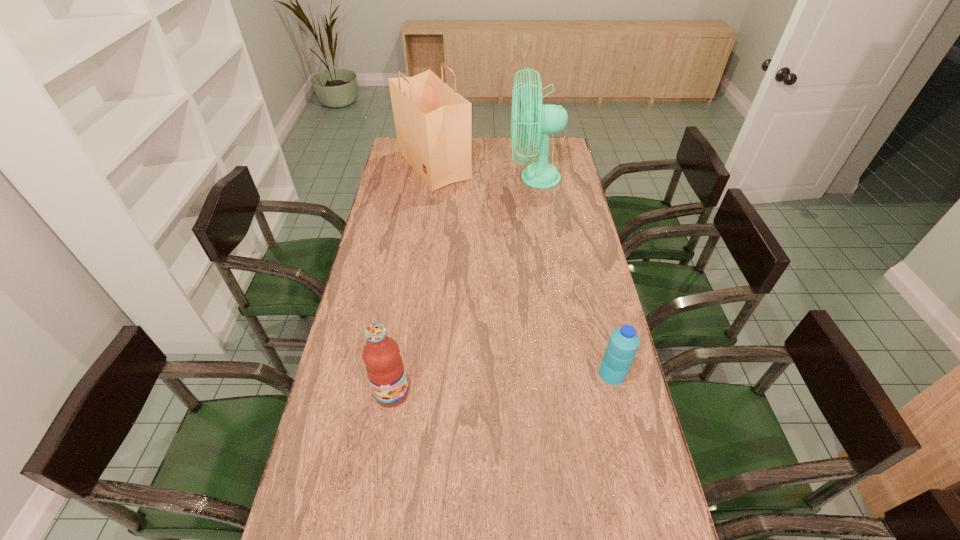
This screenshot has height=540, width=960. Find the location of `vacant area that lies between the grocery bag and the shortest object`. vacant area that lies between the grocery bag and the shortest object is located at coordinates (523, 269).

Identify the location of empty space between the third tallest object and the water bottle. (502, 383).

Identify which object is the second nearest to the grocery bag. Please provide its 2D coordinates. Your answer should be formatted as a tuple, i.e. [(x, y)], where the tuple contains the x and y coordinates of a point satisfying the conditions above.

[(384, 366)]

Select which object appears as the closest to the fan. Please provide its 2D coordinates. Your answer should be formatted as a tuple, i.e. [(x, y)], where the tuple contains the x and y coordinates of a point satisfying the conditions above.

[(433, 122)]

Locate an element on the screen. free spot that satisfies the following two spatial constraints: 1. in front of the water bottle to blow air; 2. on the right side of the fan is located at coordinates (564, 374).

Image resolution: width=960 pixels, height=540 pixels. I want to click on vacant space that satisfies the following two spatial constraints: 1. on the side of the grocery bag with the superhero design; 2. on the back side of the shortest object, so click(x=406, y=374).

Identify the location of vacant space that satisfies the following two spatial constraints: 1. in front of the fan to blow air; 2. on the front label of the fruit juice. This screenshot has width=960, height=540. (567, 393).

This screenshot has width=960, height=540. In order to click on vacant space that satisfies the following two spatial constraints: 1. on the side of the grocery bag with the superhero design; 2. on the front label of the fruit juice in this screenshot , I will do (403, 393).

This screenshot has width=960, height=540. Find the location of `vacant area in the image that satisfies the following two spatial constraints: 1. in front of the fan to blow air; 2. on the right side of the shortest object`. vacant area in the image that satisfies the following two spatial constraints: 1. in front of the fan to blow air; 2. on the right side of the shortest object is located at coordinates (564, 374).

This screenshot has width=960, height=540. I want to click on vacant area that satisfies the following two spatial constraints: 1. on the side of the grocery bag with the superhero design; 2. on the right side of the shortest object, so click(406, 374).